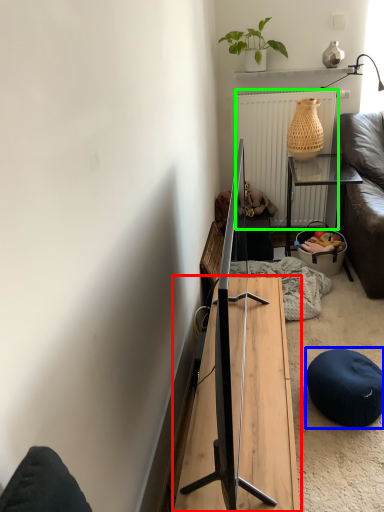
Question: Which object is the closest to the table (highlighted by a red box)? Choose among these: stool (highlighted by a blue box) or radiator (highlighted by a green box).

Choices:
 (A) stool
 (B) radiator

Answer: (A)